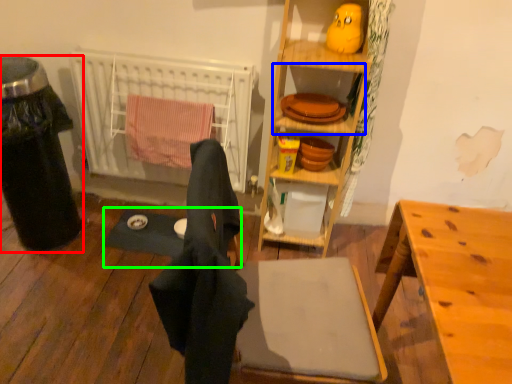
Question: Estimate the real-world distances between objects in this image. Which object is farther from trash bin/can (highlighted by a red box), shelf (highlighted by a blue box) or yoga mat (highlighted by a green box)?

Choices:
 (A) shelf
 (B) yoga mat

Answer: (A)